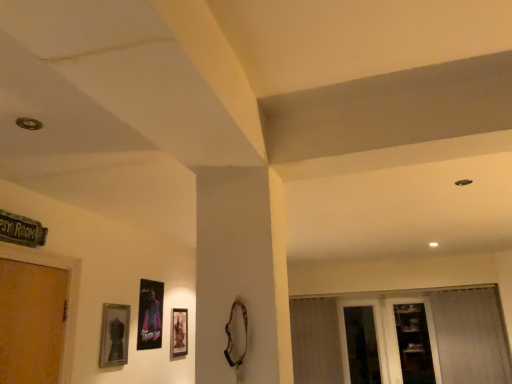
Where is `transparent glass screen door at lower right`? transparent glass screen door at lower right is located at coordinates (362, 345).

Locate an element on the screen. This screenshot has height=384, width=512. white sheer curtain at right is located at coordinates (470, 337).

Locate an element on the screen. transparent glass door at lower right is located at coordinates (387, 336).

Find the location of `metallic poster at center, the second picture frame when ordered from back to front`. metallic poster at center, the second picture frame when ordered from back to front is located at coordinates (150, 315).

Find the location of a particular element. The height and width of the screenshot is (384, 512). wooden shelf at lower right is located at coordinates (414, 344).

Find the location of a particular element. This screenshot has height=384, width=512. transparent glass screen door at lower right is located at coordinates (362, 345).

Does wooden shelf at lower right appear on the left side of metallic poster at center, arranged as the 2th picture frame when viewed from the right?

No.

Considering their positions, is wooden shelf at lower right located in front of or behind metallic poster at center, the second picture frame when ordered from back to front?

Clearly, wooden shelf at lower right is behind metallic poster at center, the second picture frame when ordered from back to front.

Would you say wooden shelf at lower right is a long distance from metallic poster at center, which appears as the second picture frame when viewed from the front?

wooden shelf at lower right is far away from metallic poster at center, which appears as the second picture frame when viewed from the front.

Considering the sizes of matte black picture frame at lower center, the first picture frame from the back, and transparent glass door at lower right in the image, is matte black picture frame at lower center, the first picture frame from the back, bigger or smaller than transparent glass door at lower right?

In the image, matte black picture frame at lower center, the first picture frame from the back, appears to be smaller than transparent glass door at lower right.

Is matte black picture frame at lower center, the first picture frame from the back, taller or shorter than transparent glass door at lower right?

Clearly, matte black picture frame at lower center, the first picture frame from the back, is shorter compared to transparent glass door at lower right.

From a real-world perspective, is matte black picture frame at lower center, which appears as the first picture frame when viewed from the right, beneath transparent glass door at lower right?

No, from a real-world perspective, matte black picture frame at lower center, which appears as the first picture frame when viewed from the right, is not below transparent glass door at lower right.

Does point (179, 347) come in front of point (355, 301)?

That is True.

Can you confirm if matte silver picture frame at lower left, acting as the first picture frame starting from the left, is wider than wooden shelf at lower right?

Incorrect, the width of matte silver picture frame at lower left, acting as the first picture frame starting from the left, does not surpass that of wooden shelf at lower right.

Considering the positions of objects matte silver picture frame at lower left, the 3th picture frame positioned from the right, and wooden shelf at lower right in the image provided, who is behind, matte silver picture frame at lower left, the 3th picture frame positioned from the right, or wooden shelf at lower right?

wooden shelf at lower right.

Is matte silver picture frame at lower left, the 3th picture frame positioned from the right, taller than wooden shelf at lower right?

No.

Looking at the image, does matte silver picture frame at lower left, acting as the first picture frame starting from the left, seem bigger or smaller compared to wooden shelf at lower right?

Clearly, matte silver picture frame at lower left, acting as the first picture frame starting from the left, is smaller in size than wooden shelf at lower right.

This screenshot has height=384, width=512. What are the coordinates of `picture frame on the left of metallic poster at center, the second picture frame when ordered from back to front` in the screenshot? It's located at (114, 335).

Consider the image. From the image's perspective, is metallic poster at center, the second picture frame when ordered from back to front, located above matte silver picture frame at lower left, acting as the first picture frame starting from the left?

Incorrect, from the image's perspective, metallic poster at center, the second picture frame when ordered from back to front, is lower than matte silver picture frame at lower left, acting as the first picture frame starting from the left.

In the image, is metallic poster at center, the second picture frame when ordered from back to front, positioned in front of or behind matte silver picture frame at lower left, the 3th picture frame positioned from the right?

Clearly, metallic poster at center, the second picture frame when ordered from back to front, is behind matte silver picture frame at lower left, the 3th picture frame positioned from the right.

Looking at their sizes, would you say metallic poster at center, positioned as the second picture frame in left-to-right order, is wider or thinner than matte silver picture frame at lower left, acting as the first picture frame starting from the left?

Considering their sizes, metallic poster at center, positioned as the second picture frame in left-to-right order, looks slimmer than matte silver picture frame at lower left, acting as the first picture frame starting from the left.

Is matte silver picture frame at lower left, placed as the third picture frame when sorted from back to front, completely or partially outside of white sheer curtain at right?

matte silver picture frame at lower left, placed as the third picture frame when sorted from back to front, lies outside white sheer curtain at right's area.

Is point (101, 358) closer to camera compared to point (481, 329)?

Yes.

Does matte silver picture frame at lower left, the 1th picture frame when ordered from front to back, appear on the right side of white sheer curtain at right?

In fact, matte silver picture frame at lower left, the 1th picture frame when ordered from front to back, is to the left of white sheer curtain at right.

From the image's perspective, which picture frame is the 3rd one above the white sheer curtain at right? Please provide its 2D coordinates.

[(114, 335)]

Considering the relative sizes of matte black picture frame at lower center, which is the third picture frame from front to back, and wooden shelf at lower right in the image provided, is matte black picture frame at lower center, which is the third picture frame from front to back, smaller than wooden shelf at lower right?

Yes, matte black picture frame at lower center, which is the third picture frame from front to back, is smaller than wooden shelf at lower right.

Which of these two, matte black picture frame at lower center, which appears as the first picture frame when viewed from the right, or wooden shelf at lower right, is thinner?

Thinner between the two is matte black picture frame at lower center, which appears as the first picture frame when viewed from the right.

Is matte black picture frame at lower center, which appears as the first picture frame when viewed from the right, positioned with its back to wooden shelf at lower right?

matte black picture frame at lower center, which appears as the first picture frame when viewed from the right, does not have its back to wooden shelf at lower right.

This screenshot has height=384, width=512. In order to click on shelf behind the matte black picture frame at lower center, the third picture frame positioned from the left in this screenshot , I will do `click(414, 344)`.

Would you say transparent glass screen door at lower right is outside matte silver picture frame at lower left, placed as the third picture frame when sorted from back to front?

transparent glass screen door at lower right lies outside matte silver picture frame at lower left, placed as the third picture frame when sorted from back to front,'s area.

How much distance is there between transparent glass screen door at lower right and matte silver picture frame at lower left, the 3th picture frame positioned from the right?

They are 3.04 meters apart.

Does transparent glass screen door at lower right appear on the left side of matte silver picture frame at lower left, the 1th picture frame when ordered from front to back?

Incorrect, transparent glass screen door at lower right is not on the left side of matte silver picture frame at lower left, the 1th picture frame when ordered from front to back.

From the image's perspective, between transparent glass screen door at lower right and matte silver picture frame at lower left, placed as the third picture frame when sorted from back to front, who is located below?

transparent glass screen door at lower right appears lower in the image.

In the image, there is a metallic poster at center, which appears as the second picture frame when viewed from the front. Identify the location of shelf below it (from a real-world perspective). point(414,344).

This screenshot has height=384, width=512. What are the coordinates of `glass door lying on the right of matte black picture frame at lower center, which is the third picture frame from front to back` in the screenshot? It's located at (387, 336).

Which object lies further to the anchor point transparent glass screen door at lower right, matte silver picture frame at lower left, the 3th picture frame positioned from the right, or metallic poster at center, which appears as the second picture frame when viewed from the front?

Among the two, matte silver picture frame at lower left, the 3th picture frame positioned from the right, is located further to transparent glass screen door at lower right.

Looking at this image, from the image, which object appears to be farther from white sheer curtain at right, wooden shelf at lower right or matte black picture frame at lower center, the third picture frame positioned from the left?

matte black picture frame at lower center, the third picture frame positioned from the left, lies further to white sheer curtain at right than the other object.

From the image, which object appears to be farther from white sheer curtain at right, transparent glass screen door at lower right or metallic poster at center, which appears as the second picture frame when viewed from the front?

metallic poster at center, which appears as the second picture frame when viewed from the front, lies further to white sheer curtain at right than the other object.

Based on their spatial positions, is wooden shelf at lower right or metallic poster at center, arranged as the 2th picture frame when viewed from the right, further from matte black picture frame at lower center, the third picture frame positioned from the left?

Among the two, wooden shelf at lower right is located further to matte black picture frame at lower center, the third picture frame positioned from the left.

When comparing their distances from transparent glass door at lower right, does transparent glass screen door at lower right or matte silver picture frame at lower left, the 3th picture frame positioned from the right, seem closer?

Among the two, transparent glass screen door at lower right is located nearer to transparent glass door at lower right.

Based on their spatial positions, is white sheer curtain at right or matte black picture frame at lower center, which is the third picture frame from front to back, further from wooden shelf at lower right?

matte black picture frame at lower center, which is the third picture frame from front to back.

Estimate the real-world distances between objects in this image. Which object is closer to transparent glass door at lower right, white sheer curtain at right or metallic poster at center, the second picture frame when ordered from back to front?

white sheer curtain at right.

Looking at the image, which one is located further to matte silver picture frame at lower left, placed as the third picture frame when sorted from back to front, transparent glass screen door at lower right or wooden shelf at lower right?

Based on the image, wooden shelf at lower right appears to be further to matte silver picture frame at lower left, placed as the third picture frame when sorted from back to front.

The width and height of the screenshot is (512, 384). Identify the location of glass door between matte black picture frame at lower center, which appears as the first picture frame when viewed from the right, and wooden shelf at lower right from left to right. (387, 336).

Where is `picture frame situated between metallic poster at center, arranged as the 2th picture frame when viewed from the right, and transparent glass screen door at lower right from left to right`? This screenshot has width=512, height=384. picture frame situated between metallic poster at center, arranged as the 2th picture frame when viewed from the right, and transparent glass screen door at lower right from left to right is located at coordinates (179, 332).

The image size is (512, 384). Identify the location of screen door between matte silver picture frame at lower left, the 3th picture frame positioned from the right, and wooden shelf at lower right, in the horizontal direction. (362, 345).

This screenshot has width=512, height=384. In order to click on glass door situated between matte black picture frame at lower center, the third picture frame positioned from the left, and white sheer curtain at right from left to right in this screenshot , I will do tap(387, 336).